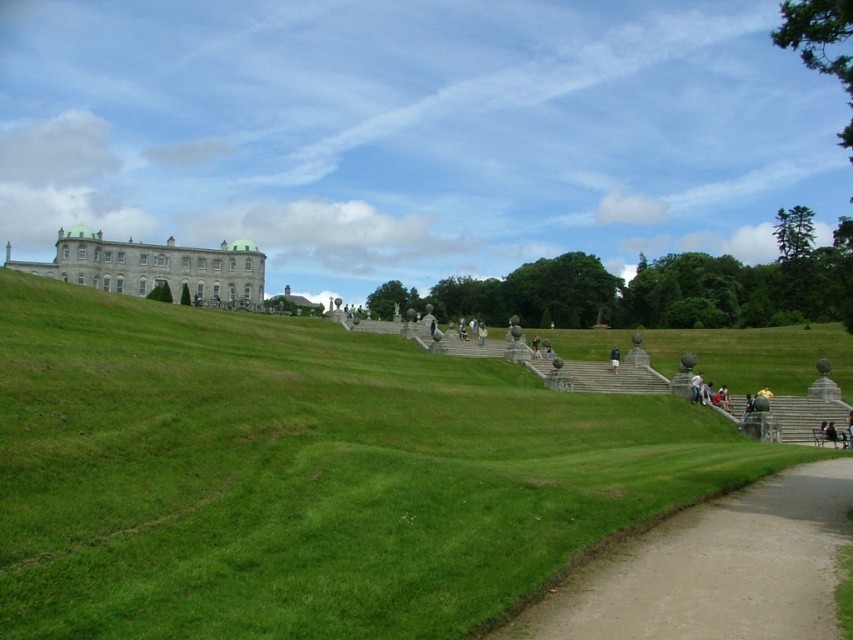
You are a landscape architect designing a new garden layout. You need to place a decorative fountain exactly halfway between the white stone palace at upper left and the dark blue jeans at center. Considering their positions, which object will the fountain be closer to?

The fountain will be closer to the dark blue jeans at center because the white stone palace at upper left might be wider than dark blue jeans at center, implying it occupies more horizontal space. Since the fountain is placed halfway between them, the palace being wider could mean the midpoint is nearer to the jeans.

Based on the photo, based on the coordinates provided, which object is located at point [305,474] in the image?

The point [305,474] corresponds to the green grassy at upper center.